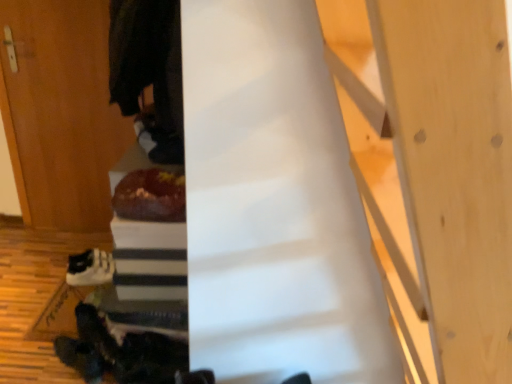
Question: In the image, is shiny chocolate cake at center on the left side or the right side of wooden door at left?

Choices:
 (A) right
 (B) left

Answer: (A)

Question: Looking at their shapes, would you say shiny chocolate cake at center is wider or thinner than wooden door at left?

Choices:
 (A) thin
 (B) wide

Answer: (B)

Question: Estimate the real-world distances between objects in this image. Which object is farther from the white matte sneakers at lower left?

Choices:
 (A) wooden door at left
 (B) dark woolen robe at upper left
 (C) shiny chocolate cake at center

Answer: (B)

Question: Estimate the real-world distances between objects in this image. Which object is farther from the dark woolen robe at upper left?

Choices:
 (A) white matte sneakers at lower left
 (B) shiny chocolate cake at center
 (C) wooden door at left

Answer: (A)